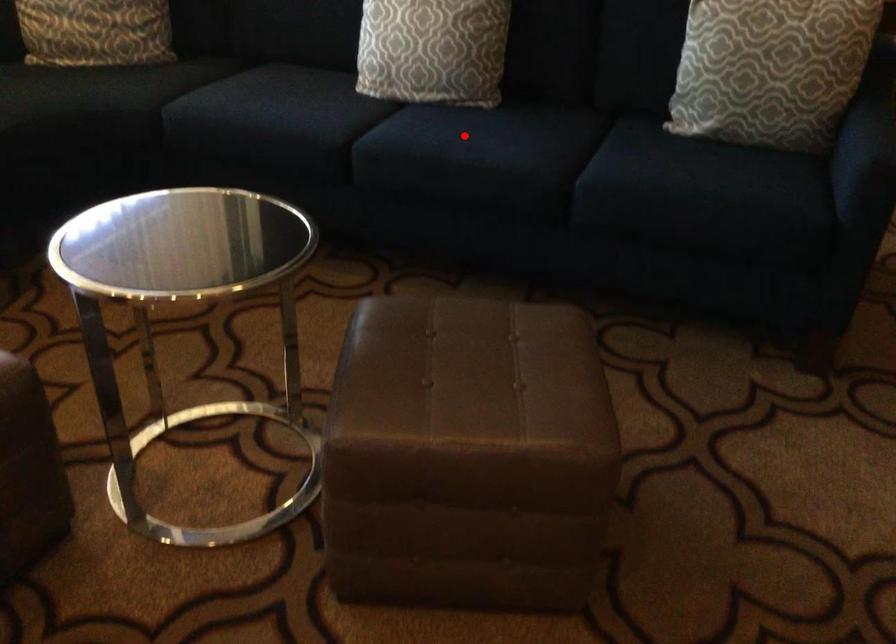
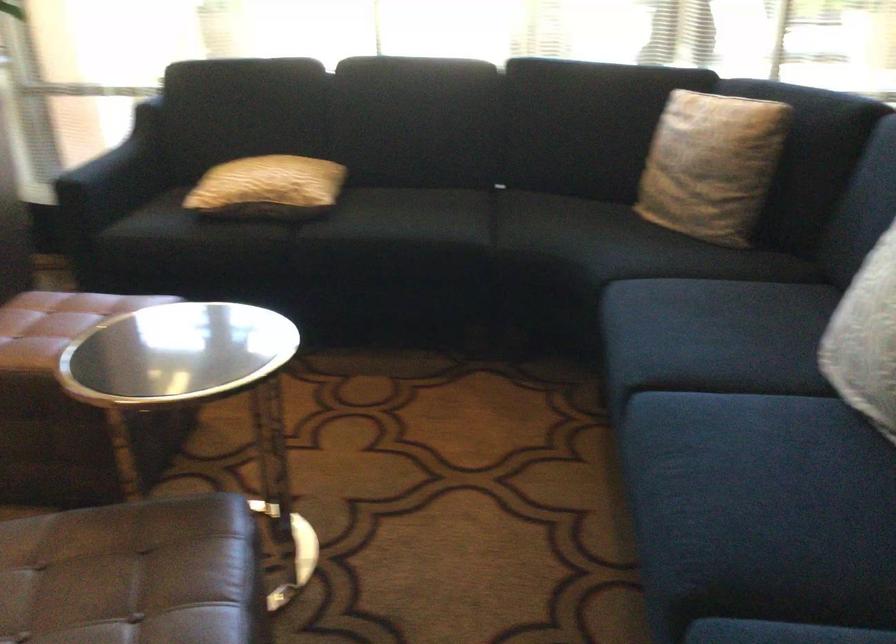
Question: I am providing you with two images of the same scene from different viewpoints. A red point is marked on the first image. Can you still see the location of the red point in image 2?

Choices:
 (A) Yes
 (B) No

Answer: (A)